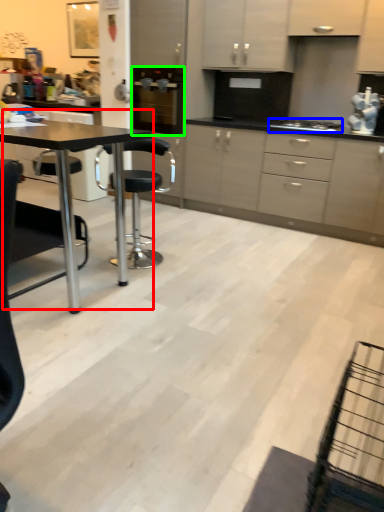
Question: Based on their relative distances, which object is farther from table (highlighted by a red box)? Choose from gas stove (highlighted by a blue box) and kitchen appliance (highlighted by a green box).

Choices:
 (A) gas stove
 (B) kitchen appliance

Answer: (A)